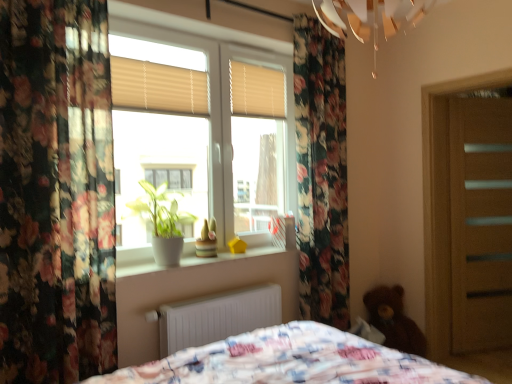
Question: From the image's perspective, is white plastic window at center positioned above or below floral fabric curtain at left?

Choices:
 (A) above
 (B) below

Answer: (A)

Question: From a real-world perspective, is white plastic window at center physically located above or below floral fabric curtain at left?

Choices:
 (A) below
 (B) above

Answer: (B)

Question: Based on their relative distances, which object is farther from the floral fabric curtain at left?

Choices:
 (A) beige fabric blinds at upper center, the second shutter from the right
 (B) green matte plant at window
 (C) brown plush teddy bear at lower right
 (D) white matte radiator at lower center
 (E) white plastic window at center

Answer: (C)

Question: Which of these objects is positioned closest to the green matte plant at window?

Choices:
 (A) brown plush teddy bear at lower right
 (B) white plastic window at center
 (C) beige fabric blinds at upper center, acting as the first shutter starting from the front
 (D) beige/wooden blinds at upper center, arranged as the second shutter when viewed from the front
 (E) white matte radiator at lower center

Answer: (B)